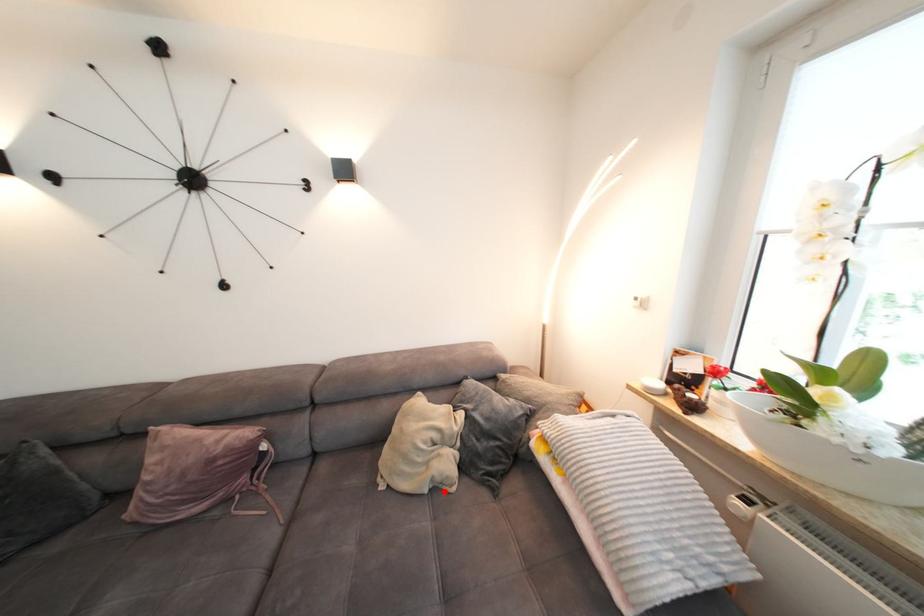
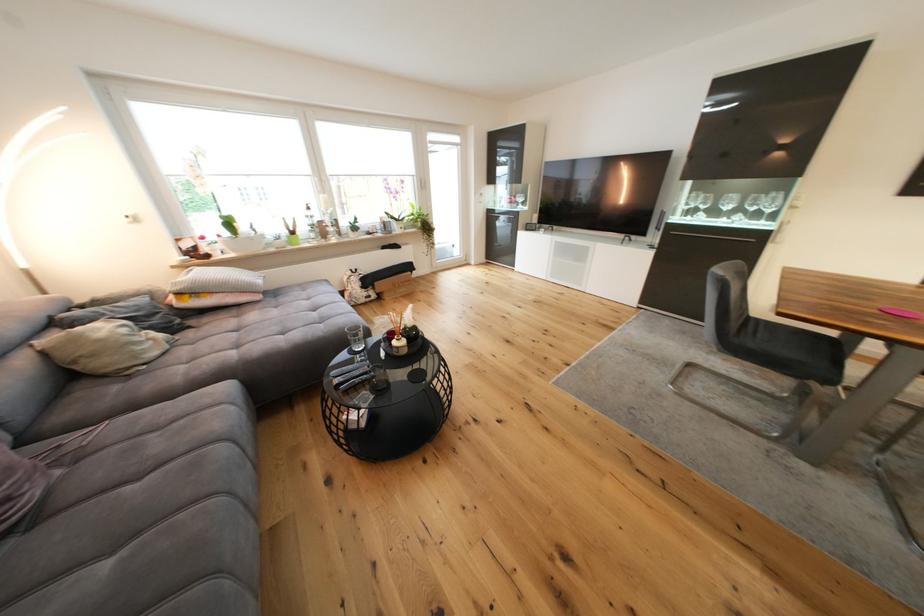
The point at the highlighted location is marked in the first image. Where is the corresponding point in the second image?

(178, 345)